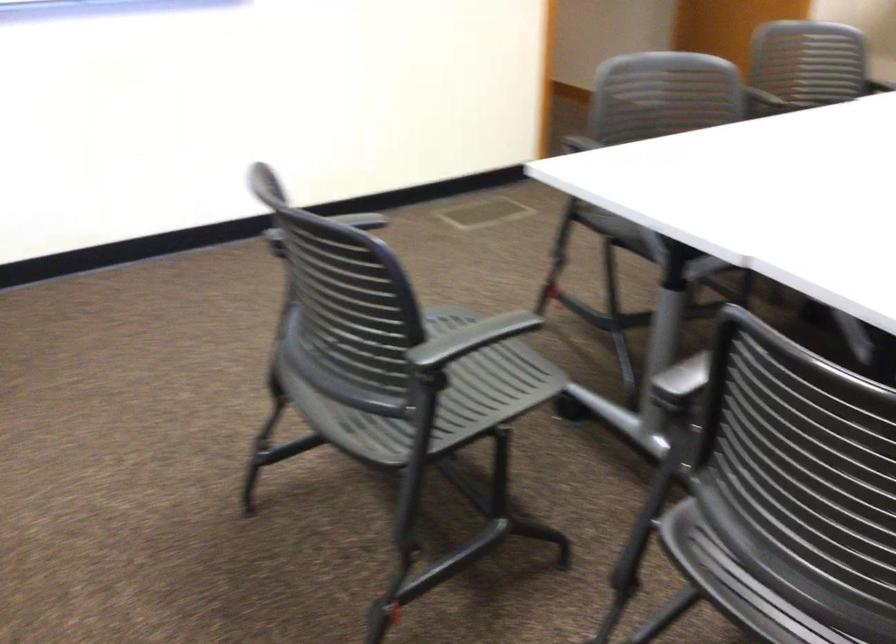
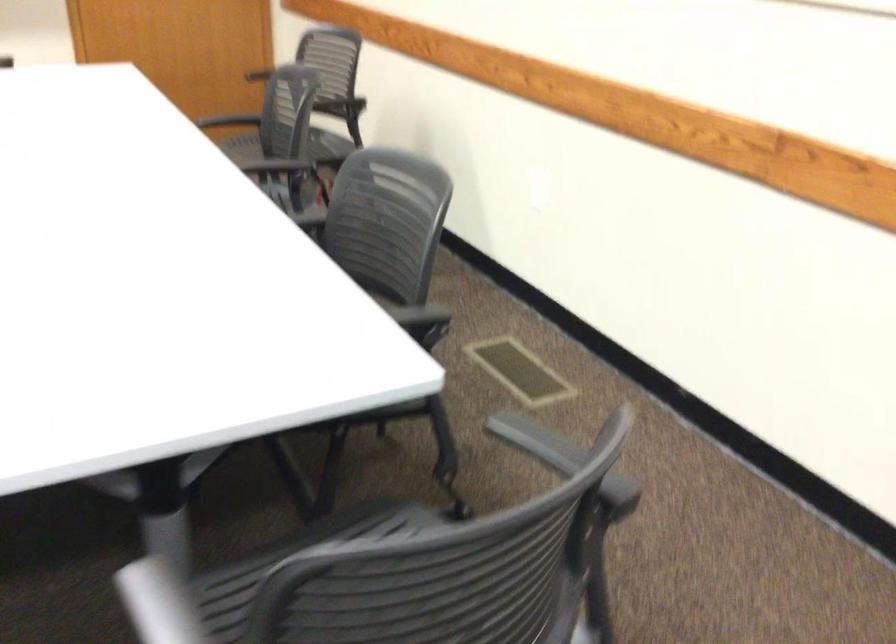
Based on the continuous images, in which direction is the camera rotating?

The camera's rotation is toward right-down.